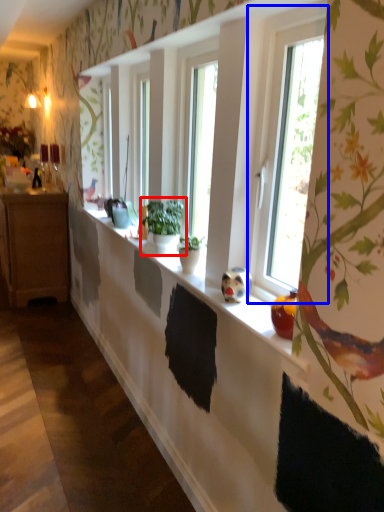
Question: Which of the following is the farthest to the observer, houseplant (highlighted by a red box) or window (highlighted by a blue box)?

Choices:
 (A) houseplant
 (B) window

Answer: (A)